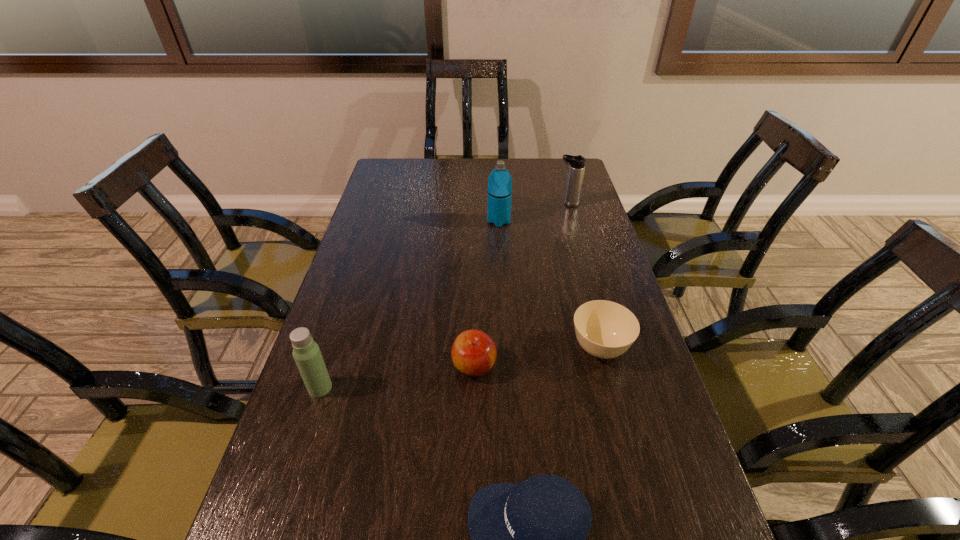
You are a GUI agent. You are given a task and a screenshot of the screen. Output one action in this format:
    pyautogui.click(x=<x>, y=<y>)
    Task: Click on the free space between the farthest object and the sugar bowl
    Image resolution: width=960 pixels, height=540 pixels.
    Given the screenshot: What is the action you would take?
    pyautogui.click(x=584, y=276)

At what (x,y) coordinates should I click in order to perform the action: click on vacant area between the sugar bowl and the farthest thermos bottle. Please return your answer as a coordinate pair (x, y). The width and height of the screenshot is (960, 540). Looking at the image, I should click on (584, 276).

The image size is (960, 540). Identify the location of object that is the closest to the leftmost thermos bottle. (473, 353).

The height and width of the screenshot is (540, 960). I want to click on the closest object to the leftmost object, so coord(473,353).

This screenshot has width=960, height=540. In order to click on thermos bottle that is the second nearest to the leftmost object in this screenshot , I will do `click(577, 163)`.

Where is `the third closest thermos bottle to the sugar bowl`? the third closest thermos bottle to the sugar bowl is located at coordinates (577, 163).

You are a GUI agent. You are given a task and a screenshot of the screen. Output one action in this format:
    pyautogui.click(x=<x>, y=<y>)
    Task: Click on the free location that satisfies the following two spatial constraints: 1. on the handle side of the farthest object; 2. on the front side of the tallest thermos bottle
    Image resolution: width=960 pixels, height=540 pixels.
    Given the screenshot: What is the action you would take?
    pyautogui.click(x=573, y=221)

Image resolution: width=960 pixels, height=540 pixels. In order to click on free space that satisfies the following two spatial constraints: 1. on the handle side of the rightmost thermos bottle; 2. on the front side of the apple in this screenshot , I will do pyautogui.click(x=614, y=366).

Find the location of a particular element. free space that satisfies the following two spatial constraints: 1. on the back side of the sugar bowl; 2. on the right side of the apple is located at coordinates pos(474,349).